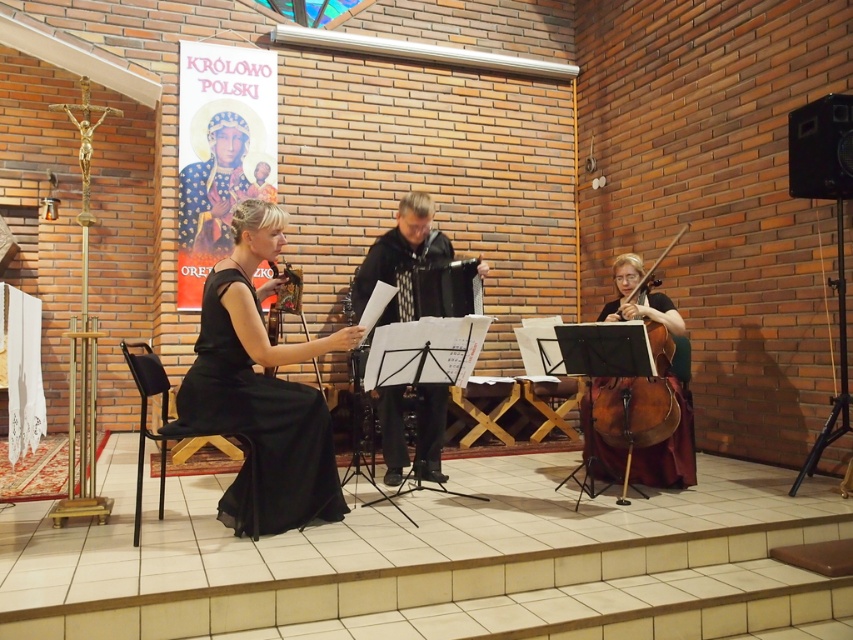
Question: Estimate the real-world distances between objects in this image. Which object is closer to the black textured accordion at center?

Choices:
 (A) brown wooden cello at right
 (B) black satin dress at center

Answer: (B)

Question: Which point is farther from the camera taking this photo?

Choices:
 (A) (650, 428)
 (B) (431, 412)

Answer: (B)

Question: Estimate the real-world distances between objects in this image. Which object is farther from the black satin dress at center?

Choices:
 (A) brown wooden cello at right
 (B) black textured accordion at center

Answer: (A)

Question: In this image, where is black satin dress at center located relative to brown wooden cello at right?

Choices:
 (A) above
 (B) below

Answer: (B)

Question: Is black textured accordion at center positioned in front of brown wooden cello at right?

Choices:
 (A) yes
 (B) no

Answer: (B)

Question: Does black satin dress at center have a greater width compared to black textured accordion at center?

Choices:
 (A) no
 (B) yes

Answer: (A)